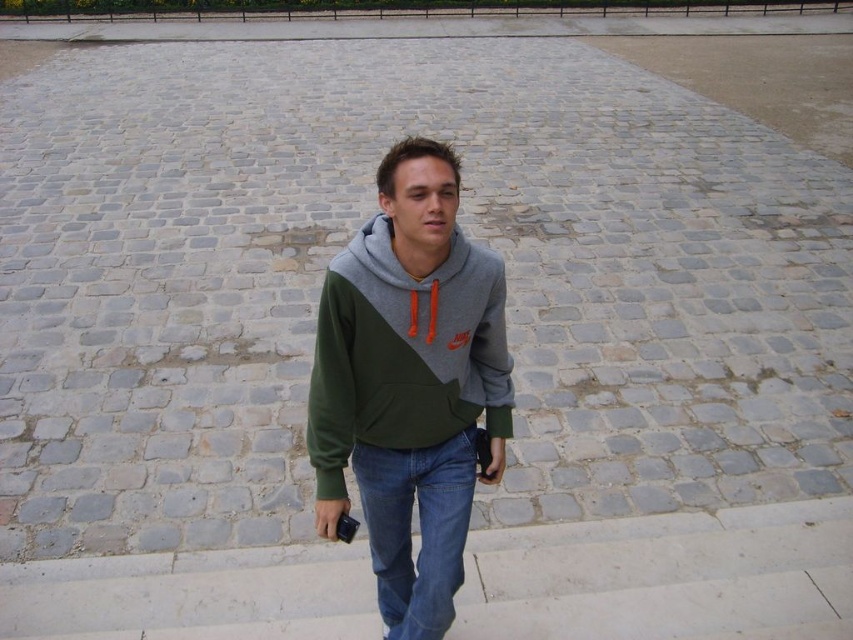
Who is taller, green fleece hoodie at center or denim at center?

Standing taller between the two is green fleece hoodie at center.

Is point (495, 272) more distant than point (474, 433)?

No, it is in front of (474, 433).

You are a GUI agent. You are given a task and a screenshot of the screen. Output one action in this format:
    pyautogui.click(x=<x>, y=<y>)
    Task: Click on the green fleece hoodie at center
    
    Given the screenshot: What is the action you would take?
    pyautogui.click(x=410, y=385)